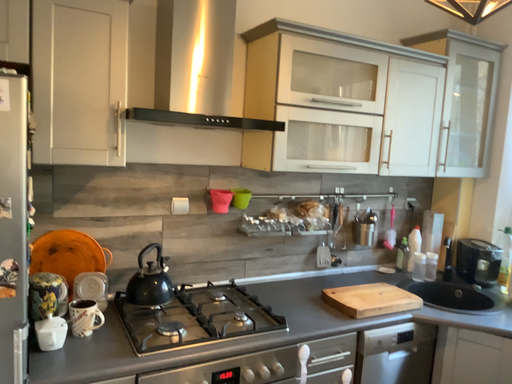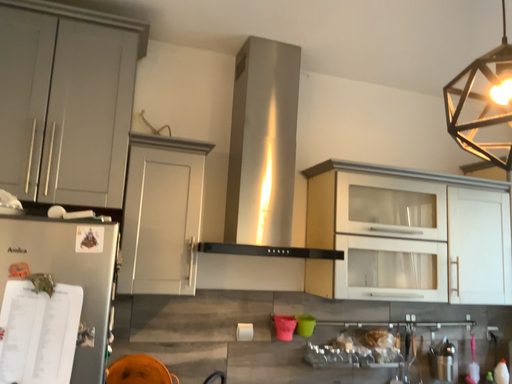
Question: How did the camera likely rotate when shooting the video?

Choices:
 (A) rotated upward
 (B) rotated downward

Answer: (A)